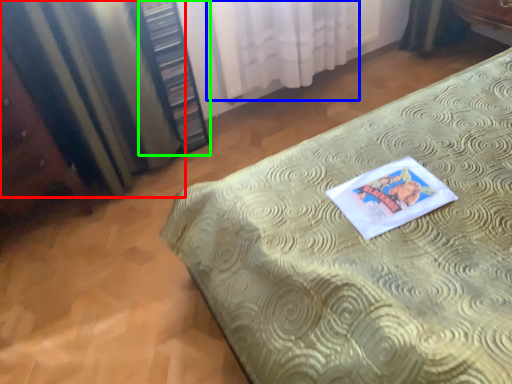
Question: Which is farther away from curtain (highlighted by a red box)? curtain (highlighted by a blue box) or bookshelf (highlighted by a green box)?

Choices:
 (A) curtain
 (B) bookshelf

Answer: (A)